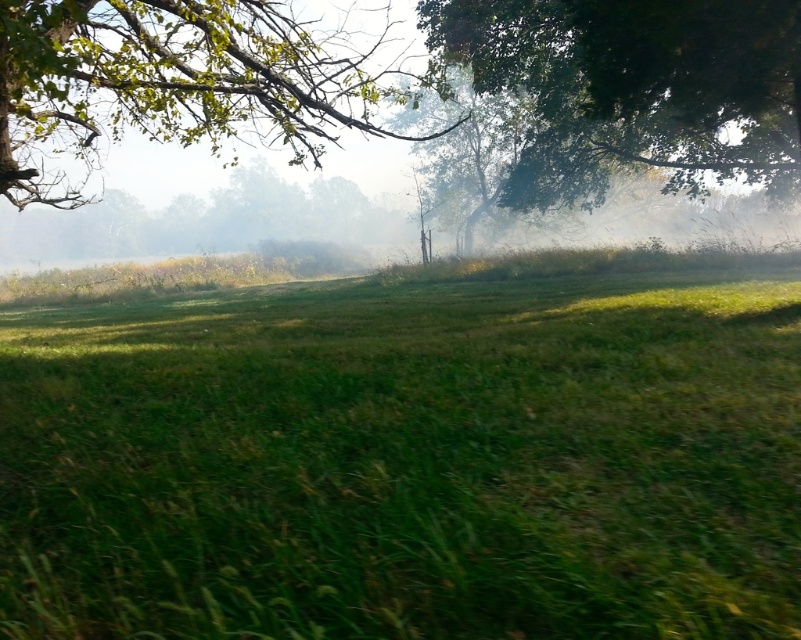
Question: Can you confirm if green leafy tree at upper right is positioned to the right of green leafy tree at upper left?

Choices:
 (A) yes
 (B) no

Answer: (A)

Question: Can you confirm if green grassy field at center is positioned to the right of green leafy tree at upper left?

Choices:
 (A) no
 (B) yes

Answer: (B)

Question: Which object is positioned closest to the green grassy field at center?

Choices:
 (A) green leafy tree at upper right
 (B) green leafy tree at upper left

Answer: (A)

Question: Estimate the real-world distances between objects in this image. Which object is farther from the green leafy tree at upper left?

Choices:
 (A) green leafy tree at upper right
 (B) green grassy field at center

Answer: (A)

Question: Which point appears closest to the camera in this image?

Choices:
 (A) (588, 141)
 (B) (199, 140)

Answer: (A)

Question: Is green grassy field at center above green leafy tree at upper left?

Choices:
 (A) yes
 (B) no

Answer: (B)